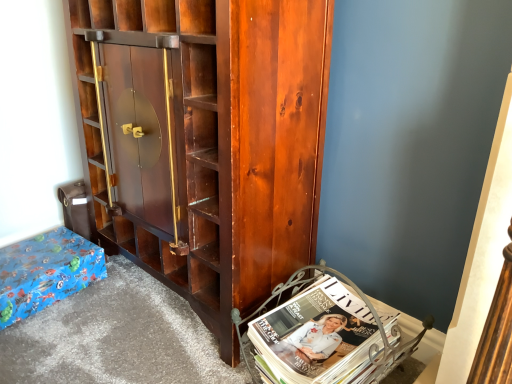
The width and height of the screenshot is (512, 384). Describe the element at coordinates (46, 272) in the screenshot. I see `blue wrapping paper at lower left` at that location.

At what (x,y) coordinates should I click in order to perform the action: click on white glossy magazine at lower right. Please return your answer as a coordinate pair (x, y). The width and height of the screenshot is (512, 384). Looking at the image, I should click on click(317, 337).

How many degrees apart are the facing directions of shiny dark wood cabinet at center and blue wrapping paper at lower left?

The angle between the facing direction of shiny dark wood cabinet at center and the facing direction of blue wrapping paper at lower left is 96 degrees.

From a real-world perspective, is shiny dark wood cabinet at center beneath blue wrapping paper at lower left?

No, from a real-world perspective, shiny dark wood cabinet at center is not below blue wrapping paper at lower left.

Is shiny dark wood cabinet at center not close to blue wrapping paper at lower left?

No, shiny dark wood cabinet at center is not far from blue wrapping paper at lower left.

Which is more to the right, shiny dark wood cabinet at center or blue wrapping paper at lower left?

shiny dark wood cabinet at center is more to the right.

Based on the photo, from the image's perspective, is shiny dark wood cabinet at center above white glossy magazine at lower right?

Yes.

Considering the sizes of objects shiny dark wood cabinet at center and white glossy magazine at lower right in the image provided, who is taller, shiny dark wood cabinet at center or white glossy magazine at lower right?

Standing taller between the two is shiny dark wood cabinet at center.

Is shiny dark wood cabinet at center next to white glossy magazine at lower right?

No, shiny dark wood cabinet at center is not touching white glossy magazine at lower right.

From a real-world perspective, between shiny dark wood cabinet at center and white glossy magazine at lower right, who is vertically higher?

In real-world perspective, shiny dark wood cabinet at center is above.

How many degrees apart are the facing directions of blue wrapping paper at lower left and shiny dark wood cabinet at center?

blue wrapping paper at lower left and shiny dark wood cabinet at center are facing 96 degrees away from each other.

Where is `furniture beneath the shiny dark wood cabinet at center (from a real-world perspective)`? furniture beneath the shiny dark wood cabinet at center (from a real-world perspective) is located at coordinates (46, 272).

Does blue wrapping paper at lower left touch shiny dark wood cabinet at center?

They are not placed beside each other.

Is point (104, 261) positioned before point (185, 14)?

No.

Choose the correct answer: Is white glossy magazine at lower right inside blue wrapping paper at lower left or outside it?

white glossy magazine at lower right is spatially situated outside blue wrapping paper at lower left.

Is white glossy magazine at lower right not close to blue wrapping paper at lower left?

No.

Which of these two, white glossy magazine at lower right or blue wrapping paper at lower left, is bigger?

Bigger between the two is white glossy magazine at lower right.

In the scene shown: Which object is thinner, white glossy magazine at lower right or blue wrapping paper at lower left?

blue wrapping paper at lower left is thinner.

Is white glossy magazine at lower right located outside shiny dark wood cabinet at center?

white glossy magazine at lower right is positioned outside shiny dark wood cabinet at center.

Is white glossy magazine at lower right in front of or behind shiny dark wood cabinet at center in the image?

In the image, white glossy magazine at lower right appears behind shiny dark wood cabinet at center.

Can you confirm if white glossy magazine at lower right is shorter than shiny dark wood cabinet at center?

Yes, white glossy magazine at lower right is shorter than shiny dark wood cabinet at center.

This screenshot has height=384, width=512. I want to click on cabinetry that is in front of the white glossy magazine at lower right, so click(x=205, y=141).

From the image's perspective, is blue wrapping paper at lower left beneath white glossy magazine at lower right?

No.

From a real-world perspective, is blue wrapping paper at lower left physically located above or below white glossy magazine at lower right?

In terms of real-world spatial position, blue wrapping paper at lower left is below white glossy magazine at lower right.

Can you confirm if blue wrapping paper at lower left is smaller than white glossy magazine at lower right?

Indeed, blue wrapping paper at lower left has a smaller size compared to white glossy magazine at lower right.

This screenshot has height=384, width=512. In order to click on cabinetry above the blue wrapping paper at lower left (from a real-world perspective) in this screenshot , I will do `click(205, 141)`.

Find the location of `book lying behind the shiny dark wood cabinet at center`. book lying behind the shiny dark wood cabinet at center is located at coordinates (317, 337).

Estimate the real-world distances between objects in this image. Which object is closer to white glossy magazine at lower right, blue wrapping paper at lower left or shiny dark wood cabinet at center?

Based on the image, shiny dark wood cabinet at center appears to be nearer to white glossy magazine at lower right.

Looking at the image, which one is located closer to blue wrapping paper at lower left, shiny dark wood cabinet at center or white glossy magazine at lower right?

Based on the image, shiny dark wood cabinet at center appears to be nearer to blue wrapping paper at lower left.

From the image, which object appears to be farther from shiny dark wood cabinet at center, blue wrapping paper at lower left or white glossy magazine at lower right?

blue wrapping paper at lower left is positioned further to the anchor shiny dark wood cabinet at center.

Looking at the image, which one is located closer to blue wrapping paper at lower left, white glossy magazine at lower right or shiny dark wood cabinet at center?

The object closer to blue wrapping paper at lower left is shiny dark wood cabinet at center.

From the image, which object appears to be farther from white glossy magazine at lower right, shiny dark wood cabinet at center or blue wrapping paper at lower left?

The object further to white glossy magazine at lower right is blue wrapping paper at lower left.

Based on their spatial positions, is white glossy magazine at lower right or blue wrapping paper at lower left closer to shiny dark wood cabinet at center?

white glossy magazine at lower right is positioned closer to the anchor shiny dark wood cabinet at center.

Locate an element on the screen. The width and height of the screenshot is (512, 384). cabinetry situated between blue wrapping paper at lower left and white glossy magazine at lower right from left to right is located at coordinates (205, 141).